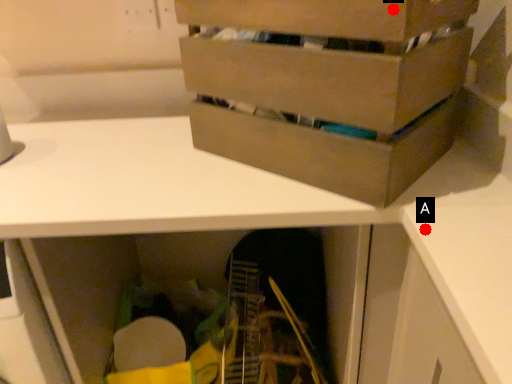
Question: Two points are circled on the image, labeled by A and B beside each circle. Which of the following is the closest to the observer?

Choices:
 (A) A is closer
 (B) B is closer

Answer: (B)